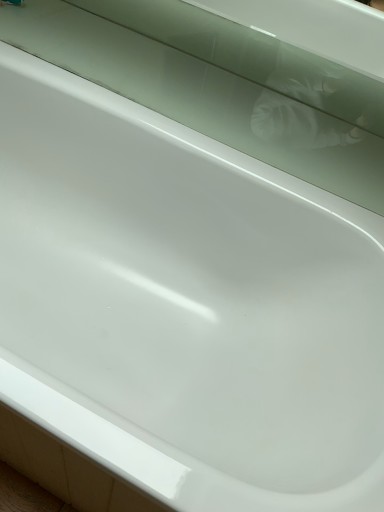
Where is `empty space that is ontop of transparent glass door at upper center (from a real-world perspective)`? Image resolution: width=384 pixels, height=512 pixels. empty space that is ontop of transparent glass door at upper center (from a real-world perspective) is located at coordinates (174, 75).